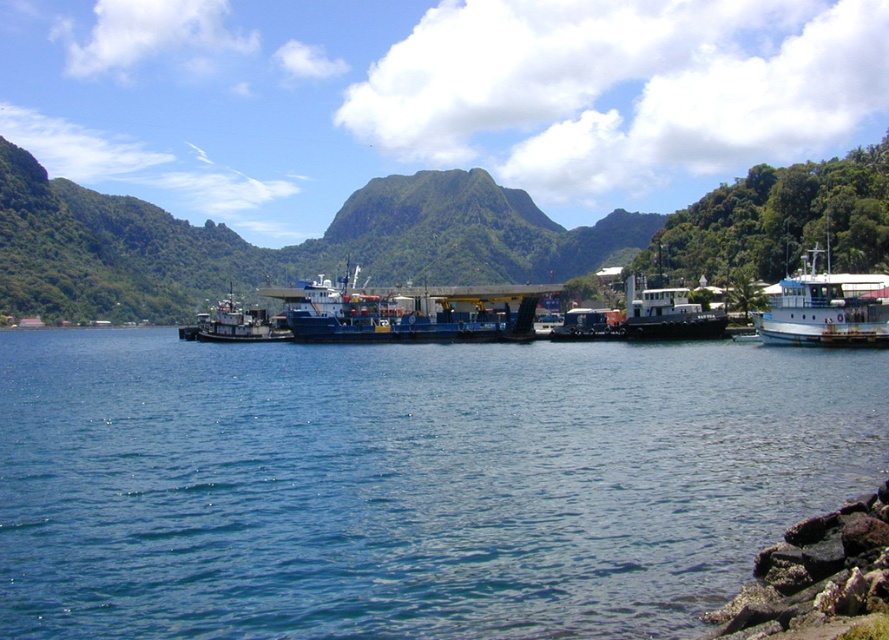
Question: Which point is farther to the camera?

Choices:
 (A) (521, 221)
 (B) (694, 320)
 (C) (258, 314)
 (D) (225, 596)

Answer: (A)

Question: Which object is closer to the camera taking this photo?

Choices:
 (A) blue matte cargo ship at center
 (B) green leafy mountain at upper center

Answer: (A)

Question: Is green leafy mountain at upper center to the right of blue matte cargo ship at center from the viewer's perspective?

Choices:
 (A) yes
 (B) no

Answer: (A)

Question: Is blue water at lower left thinner than white matte boat at right?

Choices:
 (A) yes
 (B) no

Answer: (B)

Question: Which point is farther from the camera taking this photo?

Choices:
 (A) (843, 301)
 (B) (643, 314)

Answer: (B)

Question: Can you confirm if blue matte cargo ship at center is smaller than white matte boat at right?

Choices:
 (A) yes
 (B) no

Answer: (B)